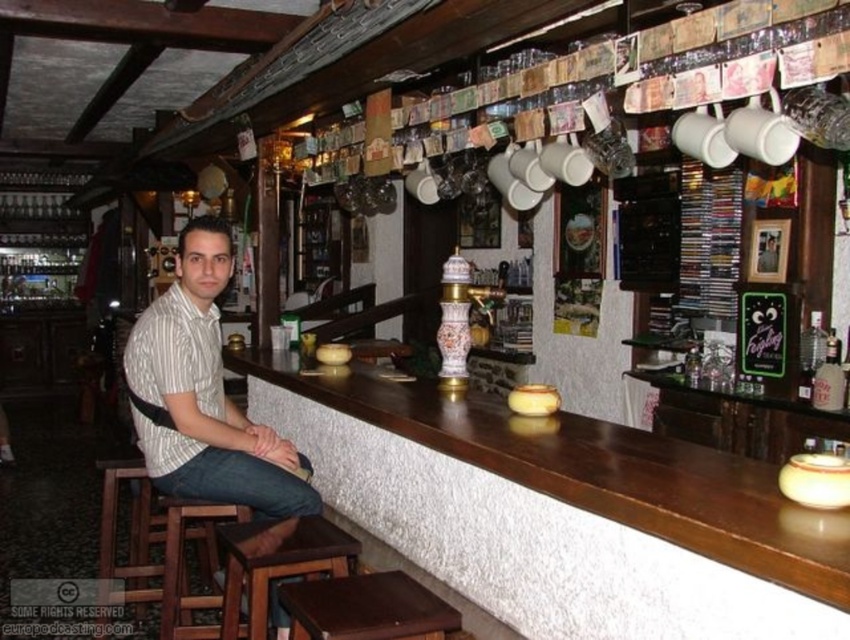
Consider the image. You are a customer sitting on the dark brown wood bar stool at lower center and want to grab a drink from the white striped shirt at center. Can you reach it without moving your stool?

The white striped shirt at center is taller than the dark brown wood bar stool at lower center, so you may need to stand or use something to reach it.

You are a customer at the bar and want to place your phone on an object. You have the white striped shirt at center and the brown wooden bar stool at lower left. Which object can you use if you want to place your phone on a larger surface?

The white striped shirt at center is bigger than the brown wooden bar stool at lower left, so you can place your phone on the white striped shirt at center since it has a larger surface.

You are standing at the entrance of the bar and want to sit down. Which object at point (x=366, y=609) corresponds to a place where you can sit?

The dark brown wood bar stool at lower center is located at point (x=366, y=609), so you can sit there.